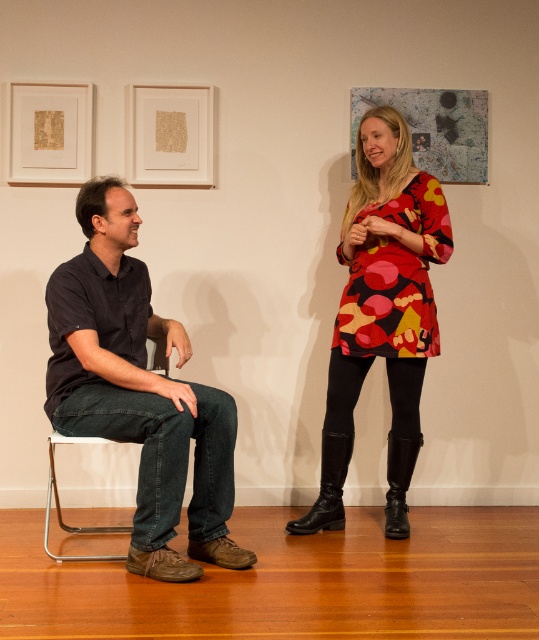
You are standing in the room and want to hand a document to both the black matte shirt at left and the printed fabric dress at center. Which person should you approach first to ensure you can reach them without moving further into the room?

You should approach the black matte shirt at left first because they are closer to you than the printed fabric dress at center, so you can reach them without moving further into the room.

You are a photographer setting up for a portrait. You have a camera with a 50mm lens focused on the black matte shirt at left. If you want to include the metallic silver chair at left in the frame without moving the camera, would you need to zoom out or zoom in?

The black matte shirt at left is bigger than the metallic silver chair at left, so to include the metallic silver chair at left in the frame without moving the camera, you would need to zoom out to capture both objects in the same shot.